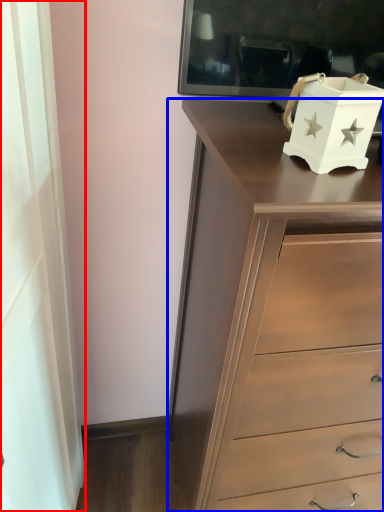
Question: Which of the following is the farthest to the observer, curtain (highlighted by a red box) or chest of drawers (highlighted by a blue box)?

Choices:
 (A) curtain
 (B) chest of drawers

Answer: (A)